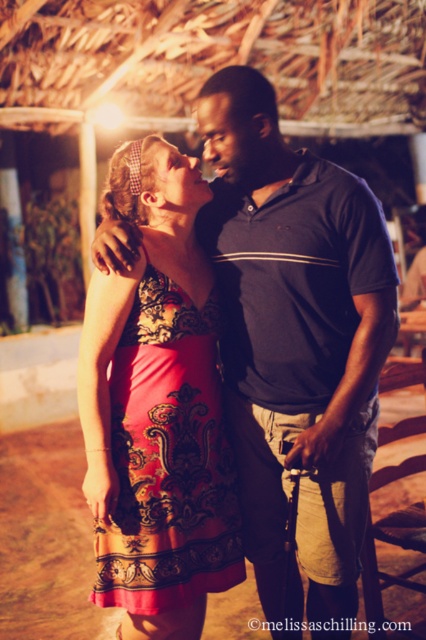
Between floral-patterned fabric dress at center and smooth skin forehead at center, which one is positioned higher?

Positioned higher is smooth skin forehead at center.

In order to click on floral-patterned fabric dress at center in this screenshot , I will do `click(167, 458)`.

Is point (166, 332) closer to viewer compared to point (201, 115)?

Yes.

This screenshot has width=426, height=640. In order to click on floral-patterned fabric dress at center in this screenshot , I will do `click(167, 458)`.

Does matte black shirt at center appear on the left side of smooth skin forehead at center?

No, matte black shirt at center is not to the left of smooth skin forehead at center.

Is matte black shirt at center wider than smooth skin forehead at center?

Indeed, matte black shirt at center has a greater width compared to smooth skin forehead at center.

Is point (224, 268) positioned behind point (229, 115)?

Yes.

Find the location of `matte black shirt at center`. matte black shirt at center is located at coordinates (298, 342).

Is matte black shirt at center shorter than floral-patterned fabric dress at center?

In fact, matte black shirt at center may be taller than floral-patterned fabric dress at center.

The height and width of the screenshot is (640, 426). What are the coordinates of `matte black shirt at center` in the screenshot? It's located at (298, 342).